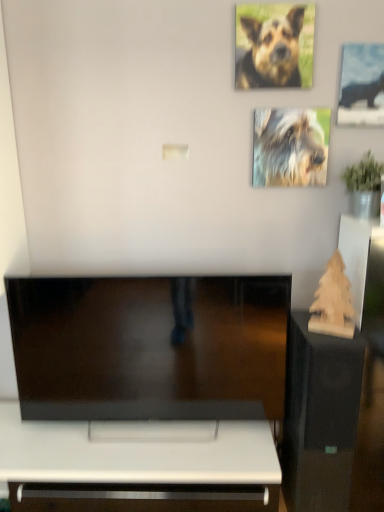
Question: Can you confirm if wooden sculpture at right is smaller than brown fur dog at upper right, the 2th dog in the back-to-front sequence?

Choices:
 (A) no
 (B) yes

Answer: (A)

Question: Is wooden sculpture at right touching brown fur dog at upper right, which is the 1th dog from top to bottom?

Choices:
 (A) no
 (B) yes

Answer: (A)

Question: Considering the relative sizes of wooden sculpture at right and brown fur dog at upper right, arranged as the second dog when ordered from the bottom, in the image provided, is wooden sculpture at right taller than brown fur dog at upper right, arranged as the second dog when ordered from the bottom,?

Choices:
 (A) no
 (B) yes

Answer: (B)

Question: From the image's perspective, does wooden sculpture at right appear lower than brown fur dog at upper right, positioned as the first dog in front-to-back order?

Choices:
 (A) yes
 (B) no

Answer: (A)

Question: Is wooden sculpture at right not near brown fur dog at upper right, which is the 1th dog from top to bottom?

Choices:
 (A) no
 (B) yes

Answer: (B)

Question: From the image's perspective, relative to shaggy fur dog at upper right, positioned as the 1th dog in back-to-front order, is brown fur dog at upper right, positioned as the first dog in front-to-back order, above or below?

Choices:
 (A) above
 (B) below

Answer: (A)

Question: Relative to shaggy fur dog at upper right, positioned as the 1th dog in back-to-front order, is brown fur dog at upper right, arranged as the second dog when ordered from the bottom, in front or behind?

Choices:
 (A) behind
 (B) front

Answer: (B)

Question: In terms of width, does brown fur dog at upper right, arranged as the second dog when ordered from the bottom, look wider or thinner when compared to shaggy fur dog at upper right, arranged as the 1th dog when ordered from the bottom?

Choices:
 (A) wide
 (B) thin

Answer: (A)

Question: In terms of size, does brown fur dog at upper right, positioned as the first dog in front-to-back order, appear bigger or smaller than shaggy fur dog at upper right, arranged as the 1th dog when ordered from the bottom?

Choices:
 (A) big
 (B) small

Answer: (A)

Question: Is wooden sculpture at right in front of or behind shaggy fur dog at upper right, which ranks as the second dog in top-to-bottom order, in the image?

Choices:
 (A) front
 (B) behind

Answer: (A)

Question: Is wooden sculpture at right situated inside shaggy fur dog at upper right, positioned as the 1th dog in back-to-front order, or outside?

Choices:
 (A) outside
 (B) inside

Answer: (A)

Question: Is wooden sculpture at right taller or shorter than shaggy fur dog at upper right, which is the second dog from front to back?

Choices:
 (A) short
 (B) tall

Answer: (B)

Question: Is point (329, 344) closer or farther from the camera than point (291, 147)?

Choices:
 (A) farther
 (B) closer

Answer: (B)

Question: In terms of size, does brown fur dog at upper right, the 2th dog in the back-to-front sequence, appear bigger or smaller than metallic silver hippo at upper right?

Choices:
 (A) small
 (B) big

Answer: (A)

Question: From a real-world perspective, is brown fur dog at upper right, arranged as the second dog when ordered from the bottom, positioned above or below metallic silver hippo at upper right?

Choices:
 (A) above
 (B) below

Answer: (A)